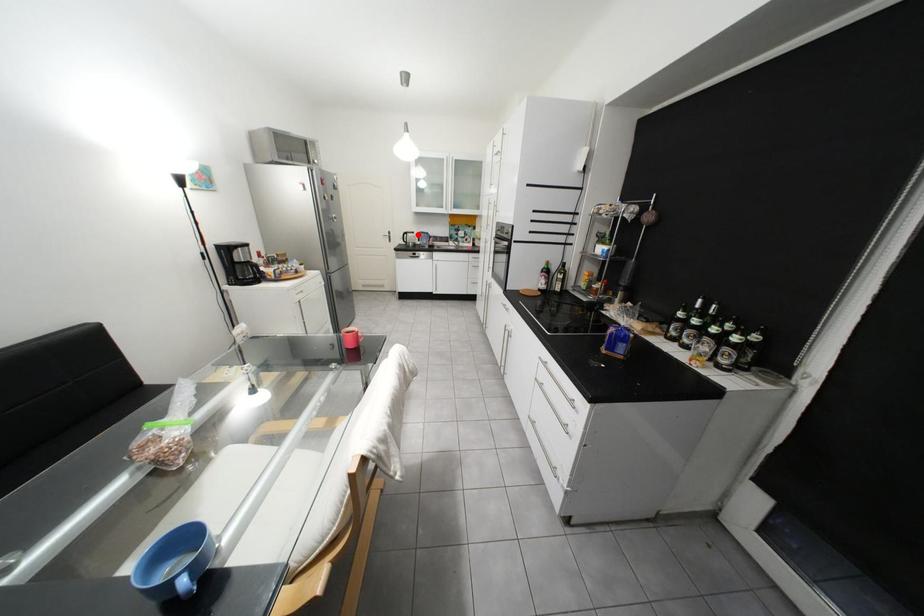
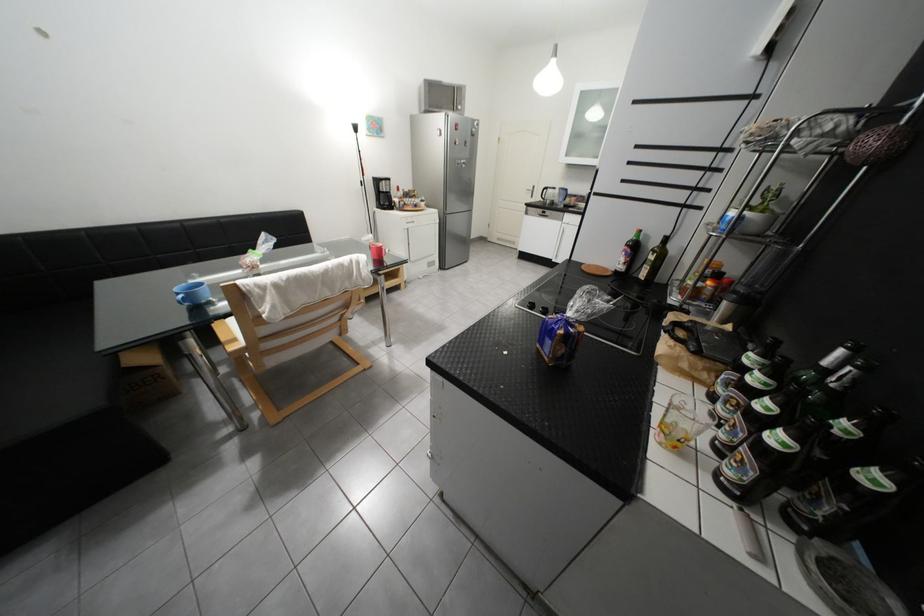
Question: I am providing you with two images of the same scene from different viewpoints. In image1, a red point is highlighted. Considering the same 3D point in image2, which of the following is correct?

Choices:
 (A) It is closer
 (B) It is farther

Answer: (A)